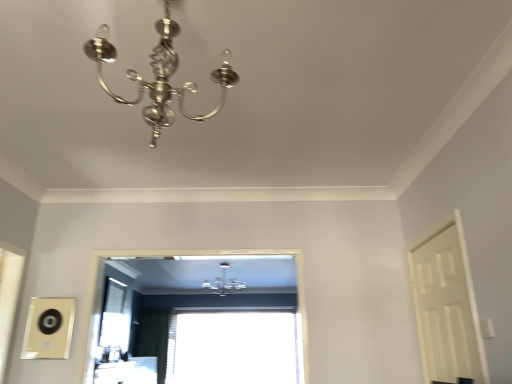
Question: In terms of height, does polished silver chandelier at upper center, which ranks as the first lamp in front-to-back order, look taller or shorter compared to transparent glass window at center, acting as the 1th window starting from the top?

Choices:
 (A) tall
 (B) short

Answer: (B)

Question: Is polished silver chandelier at upper center, the 1th lamp in the top-to-bottom sequence, inside the boundaries of transparent glass window at center, the second window in the back-to-front sequence, or outside?

Choices:
 (A) outside
 (B) inside

Answer: (A)

Question: Which object is the farthest from the transparent glass window at center, acting as the 1th window starting from the top?

Choices:
 (A) polished silver chandelier at upper center, the 1th lamp in the top-to-bottom sequence
 (B) satin silver chandelier at upper center, which is the 2th lamp in front-to-back order
 (C) transparent glass window at center, the 1th window from the bottom
 (D) white matte door at right

Answer: (A)

Question: Estimate the real-world distances between objects in this image. Which object is closer to the transparent glass window at center, the 1th window from the bottom?

Choices:
 (A) satin silver chandelier at upper center, placed as the 1th lamp when sorted from back to front
 (B) polished silver chandelier at upper center, the 1th lamp in the top-to-bottom sequence
 (C) transparent glass window at center, acting as the 1th window starting from the top
 (D) white matte door at right

Answer: (C)